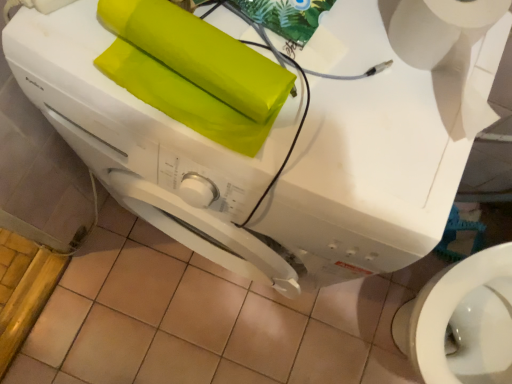
Question: Should I look upward or downward to see white matte toilet paper at upper right?

Choices:
 (A) down
 (B) up

Answer: (B)